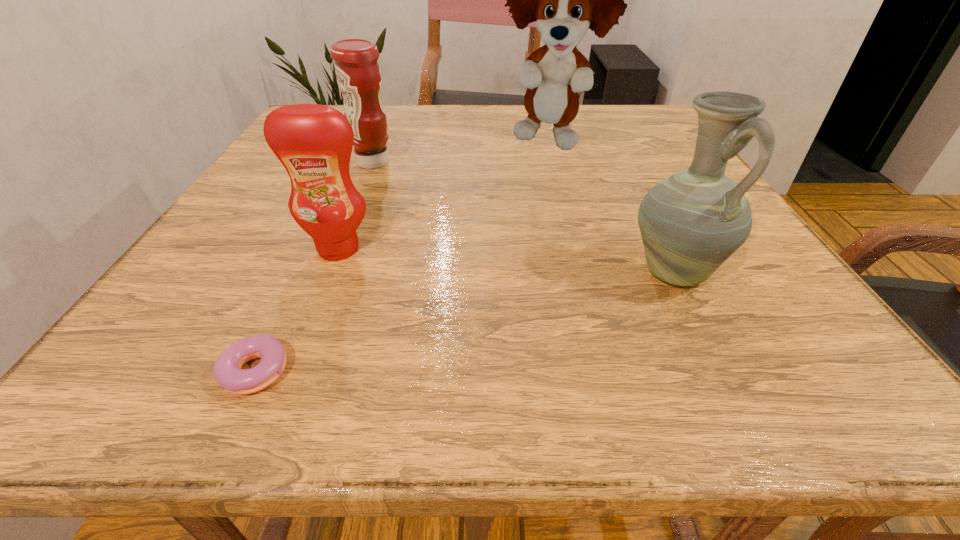
The height and width of the screenshot is (540, 960). Find the location of `free space located 0.140m on the right of the nearest object`. free space located 0.140m on the right of the nearest object is located at coordinates (404, 372).

At what (x,y) coordinates should I click in order to perform the action: click on object at the far edge. Please return your answer as a coordinate pair (x, y). The height and width of the screenshot is (540, 960). Looking at the image, I should click on (565, 0).

Image resolution: width=960 pixels, height=540 pixels. Identify the location of object located in the near edge section of the desktop. (227, 371).

Find the location of a particular element. The width and height of the screenshot is (960, 540). object present at the left edge is located at coordinates (227, 371).

This screenshot has height=540, width=960. I want to click on object present at the right edge, so tap(691, 222).

What are the coordinates of `object present at the near left corner` in the screenshot? It's located at (227, 371).

The width and height of the screenshot is (960, 540). I want to click on vacant space at the far edge of the desktop, so click(445, 119).

The width and height of the screenshot is (960, 540). In order to click on vacant space at the near edge of the desktop in this screenshot , I will do `click(248, 400)`.

In the image, there is a desktop. In order to click on vacant space at the left edge in this screenshot , I will do `click(132, 344)`.

Where is `vacant space at the right edge of the desktop`? vacant space at the right edge of the desktop is located at coordinates (840, 343).